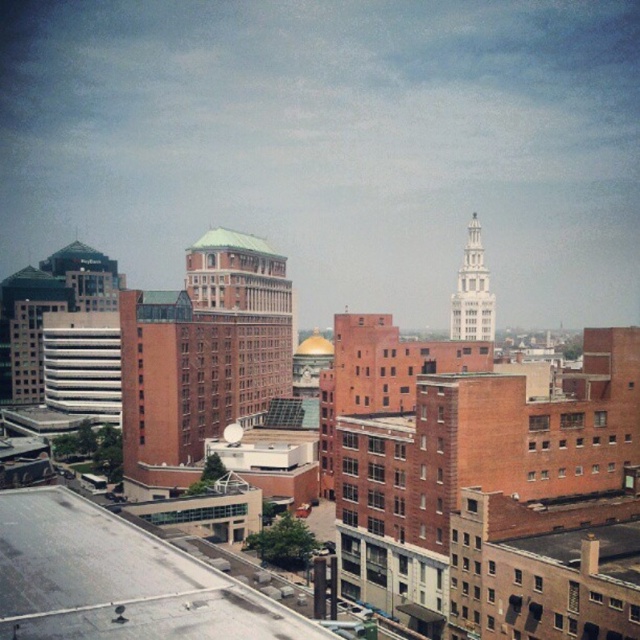
Question: Among these points, which one is nearest to the camera?

Choices:
 (A) (212, 248)
 (B) (477, 250)

Answer: (A)

Question: Does white stone tower at upper right appear on the right side of green metallic roof at center?

Choices:
 (A) yes
 (B) no

Answer: (A)

Question: Does white stone tower at upper right appear on the right side of green metallic roof at center?

Choices:
 (A) no
 (B) yes

Answer: (B)

Question: Which of the following is the farthest from the observer?

Choices:
 (A) (481, 324)
 (B) (246, 234)

Answer: (B)

Question: Can you confirm if white stone tower at upper right is positioned below green metallic roof at center?

Choices:
 (A) no
 (B) yes

Answer: (B)

Question: Which point is farther to the camera?

Choices:
 (A) green metallic roof at center
 (B) white stone tower at upper right

Answer: (B)